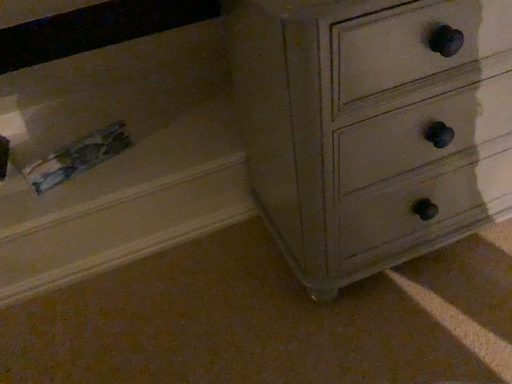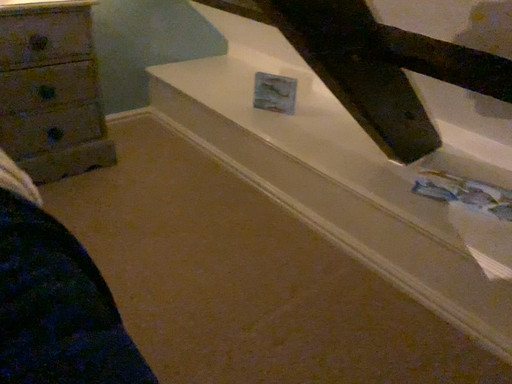
Question: How did the camera likely rotate when shooting the video?

Choices:
 (A) rotated right
 (B) rotated left

Answer: (B)